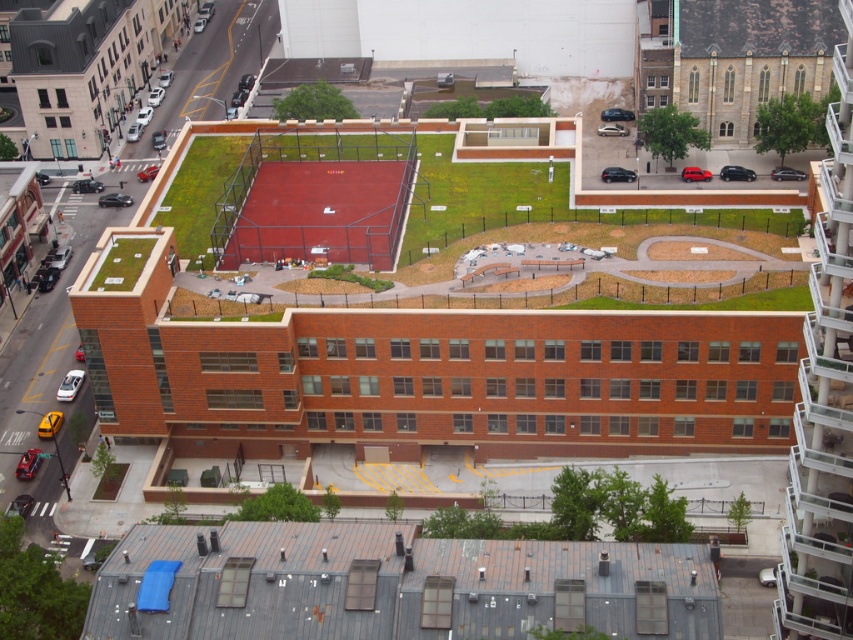
You are standing on the rooftop of the main building and looking around. There is a point marked at coordinates (392, 586). What object is located at this point?

The gray metal roof at lower center is located at point (392, 586).

You are standing on the rooftop and want to walk from the gray metal roof at lower center to the green grass at center. Is the path blocked by any object?

The gray metal roof at lower center is in front of green grass at center, so the path is blocked by the gray metal roof at lower center.